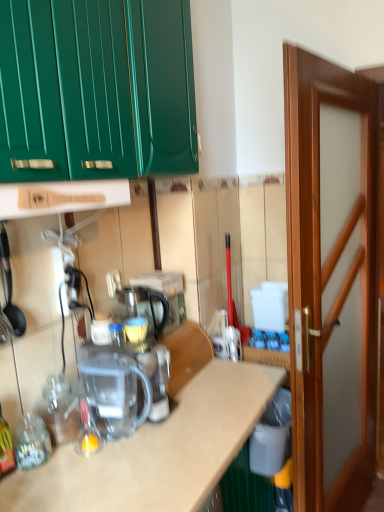
Question: Relative to wooden at center, is translucent glass bottle at lower left, which is the second bottle from back to front, in front or behind?

Choices:
 (A) front
 (B) behind

Answer: (A)

Question: Do you think translucent glass bottle at lower left, which is the second bottle from back to front, is within wooden at center, or outside of it?

Choices:
 (A) inside
 (B) outside

Answer: (B)

Question: Which of these objects is positioned closest to the translucent glass bottle at lower left, placed as the first bottle when sorted from front to back?

Choices:
 (A) transparent plastic coffee machine at center
 (B) wooden at center
 (C) transparent plastic bottle at lower left, which is counted as the first bottle, starting from the back
 (D) transparent plastic kettle at center
 (E) wooden door at right

Answer: (C)

Question: Estimate the real-world distances between objects in this image. Which object is closer to the transparent plastic bottle at lower left, which is counted as the 1th bottle, starting from the right?

Choices:
 (A) transparent plastic kettle at center
 (B) wooden at center
 (C) transparent plastic coffee machine at center
 (D) wooden door at right
 (E) translucent glass bottle at lower left, marked as the second bottle in a right-to-left arrangement

Answer: (C)